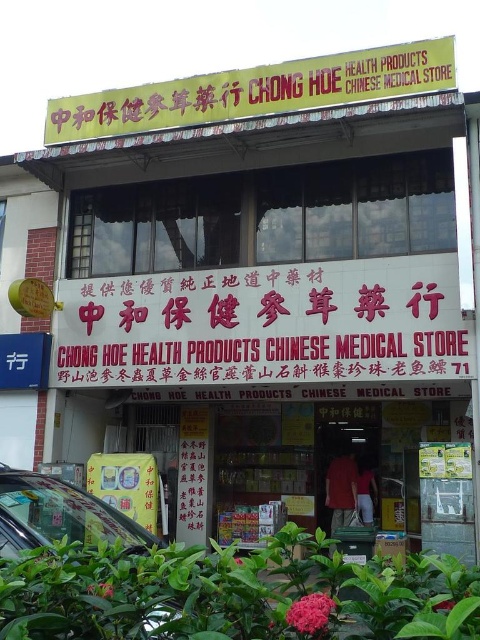
Measure the distance from pink paper sign at center to yellow matte signboard at upper center.

4.95 feet

Which is above, pink paper sign at center or yellow matte signboard at upper center?

yellow matte signboard at upper center

Identify the location of pink paper sign at center. The image size is (480, 640). (265, 324).

Which is in front, point (202, 92) or point (39, 516)?

Positioned in front is point (39, 516).

Who is higher up, yellow matte signboard at upper center or metallic silver car at lower left?

yellow matte signboard at upper center is above.

I want to click on yellow matte signboard at upper center, so click(256, 93).

Does pink paper sign at center have a smaller size compared to yellow cardboard sign at center?

Correct, pink paper sign at center occupies less space than yellow cardboard sign at center.

This screenshot has width=480, height=640. What do you see at coordinates (265, 324) in the screenshot?
I see `pink paper sign at center` at bounding box center [265, 324].

This screenshot has width=480, height=640. Find the location of `pink paper sign at center`. pink paper sign at center is located at coordinates (265, 324).